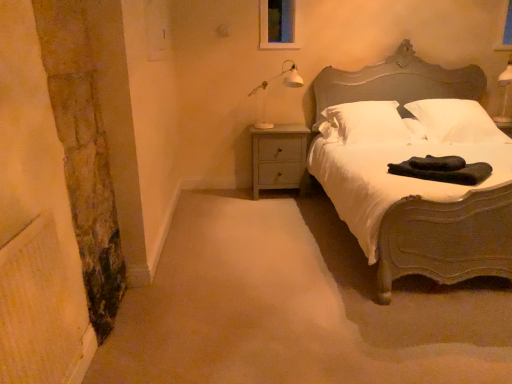
Image resolution: width=512 pixels, height=384 pixels. I want to click on dark green fabric at bed, so click(x=443, y=170).

Image resolution: width=512 pixels, height=384 pixels. In order to click on white glossy lamp at upper right in this screenshot , I will do `click(283, 84)`.

The image size is (512, 384). Find the location of `white soft pillow at center, the 2th pillow positioned from the right`. white soft pillow at center, the 2th pillow positioned from the right is located at coordinates (364, 123).

What are the coordinates of `white soft pillow at upper right, the second pillow positioned from the left` in the screenshot? It's located at (456, 121).

In the scene shown: How far apart are white painted wood nightstand at lower left and white soft pillow at center, the 1th pillow from the left?

white painted wood nightstand at lower left is 19.75 inches away from white soft pillow at center, the 1th pillow from the left.

Which of these two, white painted wood nightstand at lower left or white soft pillow at center, the 2th pillow positioned from the right, is bigger?

white soft pillow at center, the 2th pillow positioned from the right.

Considering the positions of objects white painted wood nightstand at lower left and white soft pillow at center, the 1th pillow from the left, in the image provided, who is more to the right, white painted wood nightstand at lower left or white soft pillow at center, the 1th pillow from the left,?

white soft pillow at center, the 1th pillow from the left, is more to the right.

Could you tell me if white painted wood nightstand at lower left is turned towards white soft pillow at center, the 1th pillow from the left?

No.

From the image's perspective, between white glossy lamp at upper right and white soft pillow at center, the 2th pillow positioned from the right, which one is located above?

white glossy lamp at upper right appears higher in the image.

How different are the orientations of white glossy lamp at upper right and white soft pillow at center, the 2th pillow positioned from the right, in degrees?

The angle between the facing direction of white glossy lamp at upper right and the facing direction of white soft pillow at center, the 2th pillow positioned from the right, is 0.847 degrees.

Is white glossy lamp at upper right wider or thinner than white soft pillow at center, the 2th pillow positioned from the right?

white glossy lamp at upper right is thinner than white soft pillow at center, the 2th pillow positioned from the right.

Considering the points (279, 74) and (352, 143), which point is in front, point (279, 74) or point (352, 143)?

The point (352, 143) is closer to the camera.

Is white soft pillow at center, the 2th pillow positioned from the right, spatially inside white glossy lamp at upper right, or outside of it?

white soft pillow at center, the 2th pillow positioned from the right, cannot be found inside white glossy lamp at upper right.

Is point (365, 116) positioned in front of point (286, 75)?

Yes.

I want to click on lamp on the left of the white soft pillow at center, the 1th pillow from the left, so click(x=283, y=84).

Can you confirm if white soft pillow at center, the 1th pillow from the left, is smaller than white glossy lamp at upper right?

Actually, white soft pillow at center, the 1th pillow from the left, might be larger than white glossy lamp at upper right.

From a real-world perspective, who is located lower, dark green fabric at bed or white soft pillow at center, the 2th pillow positioned from the right?

dark green fabric at bed.

From the image's perspective, is dark green fabric at bed over white soft pillow at center, the 2th pillow positioned from the right?

No, from the image's perspective, dark green fabric at bed is not above white soft pillow at center, the 2th pillow positioned from the right.

Is dark green fabric at bed looking in the opposite direction of white soft pillow at center, the 1th pillow from the left?

No, dark green fabric at bed is not facing the opposite direction of white soft pillow at center, the 1th pillow from the left.

In terms of size, does dark green fabric at bed appear bigger or smaller than white soft pillow at center, the 1th pillow from the left?

dark green fabric at bed is smaller than white soft pillow at center, the 1th pillow from the left.

From the picture: From a real-world perspective, which is physically below, matte gray bed at right or white painted wood nightstand at lower left?

From a 3D spatial view, white painted wood nightstand at lower left is below.

Is matte gray bed at right bigger than white painted wood nightstand at lower left?

Yes, matte gray bed at right is bigger than white painted wood nightstand at lower left.

Considering the relative sizes of matte gray bed at right and white painted wood nightstand at lower left in the image provided, is matte gray bed at right thinner than white painted wood nightstand at lower left?

In fact, matte gray bed at right might be wider than white painted wood nightstand at lower left.

Looking at this image, from a real-world perspective, is white soft pillow at center, the 2th pillow positioned from the right, physically below transparent glass window at upper center?

Yes, from a real-world perspective, white soft pillow at center, the 2th pillow positioned from the right, is below transparent glass window at upper center.

Is there a large distance between white soft pillow at center, the 1th pillow from the left, and transparent glass window at upper center?

No.

From the image's perspective, does white soft pillow at center, the 2th pillow positioned from the right, appear lower than transparent glass window at upper center?

Yes, from the image's perspective, white soft pillow at center, the 2th pillow positioned from the right, is below transparent glass window at upper center.

Is matte gray bed at right spatially inside white soft pillow at upper right, the second pillow positioned from the left, or outside of it?

matte gray bed at right lies outside white soft pillow at upper right, the second pillow positioned from the left.

Is matte gray bed at right looking in the opposite direction of white soft pillow at upper right, the second pillow positioned from the left?

Yes, matte gray bed at right is positioned with its back facing white soft pillow at upper right, the second pillow positioned from the left.

The width and height of the screenshot is (512, 384). Find the location of `pillow on the right of matte gray bed at right`. pillow on the right of matte gray bed at right is located at coordinates (456, 121).

Considering the relative positions of matte gray bed at right and white soft pillow at upper right, the second pillow positioned from the left, in the image provided, is matte gray bed at right to the left of white soft pillow at upper right, the second pillow positioned from the left, from the viewer's perspective?

Yes, matte gray bed at right is to the left of white soft pillow at upper right, the second pillow positioned from the left.

Locate an element on the screen. Image resolution: width=512 pixels, height=384 pixels. nightstand that is under the white soft pillow at center, the 1th pillow from the left (from a real-world perspective) is located at coordinates (280, 158).

The width and height of the screenshot is (512, 384). In order to click on the 1st pillow to the right of the white glossy lamp at upper right, counting from the anchor's position in this screenshot , I will do `click(364, 123)`.

Estimate the real-world distances between objects in this image. Which object is closer to white soft pillow at upper right, which ranks as the 1th pillow in right-to-left order, matte gray bed at right or white glossy lamp at upper right?

Among the two, matte gray bed at right is located nearer to white soft pillow at upper right, which ranks as the 1th pillow in right-to-left order.

Based on their spatial positions, is white soft pillow at center, the 2th pillow positioned from the right, or dark green fabric at bed closer to white painted wood nightstand at lower left?

white soft pillow at center, the 2th pillow positioned from the right, is positioned closer to the anchor white painted wood nightstand at lower left.

Estimate the real-world distances between objects in this image. Which object is closer to transparent glass window at upper center, white painted wood nightstand at lower left or white soft pillow at upper right, the second pillow positioned from the left?

Among the two, white painted wood nightstand at lower left is located nearer to transparent glass window at upper center.

Considering their positions, is white painted wood nightstand at lower left positioned closer to white soft pillow at center, the 2th pillow positioned from the right, than matte gray bed at right?

Based on the image, matte gray bed at right appears to be nearer to white soft pillow at center, the 2th pillow positioned from the right.

Looking at the image, which one is located closer to white painted wood nightstand at lower left, matte gray bed at right or white glossy lamp at upper right?

Among the two, white glossy lamp at upper right is located nearer to white painted wood nightstand at lower left.

Which object lies nearer to the anchor point white soft pillow at upper right, which ranks as the 1th pillow in right-to-left order, transparent glass window at upper center or white glossy lamp at upper right?

white glossy lamp at upper right.

From the image, which object appears to be nearer to matte gray bed at right, white glossy lamp at upper right or transparent glass window at upper center?

white glossy lamp at upper right is positioned closer to the anchor matte gray bed at right.

From the image, which object appears to be nearer to dark green fabric at bed, transparent glass window at upper center or white painted wood nightstand at lower left?

white painted wood nightstand at lower left is positioned closer to the anchor dark green fabric at bed.

The image size is (512, 384). Identify the location of lamp situated between white painted wood nightstand at lower left and white soft pillow at upper right, the second pillow positioned from the left, from left to right. (283, 84).

Locate an element on the screen. The image size is (512, 384). lamp between matte gray bed at right and transparent glass window at upper center along the z-axis is located at coordinates (283, 84).

Find the location of a particular element. pillow situated between white glossy lamp at upper right and white soft pillow at upper right, the second pillow positioned from the left, from left to right is located at coordinates (364, 123).

You are a GUI agent. You are given a task and a screenshot of the screen. Output one action in this format:
    pyautogui.click(x=<x>, y=<y>)
    Task: Click on the window screen between white painted wood nightstand at lower left and white soft pillow at upper right, the second pillow positioned from the left
    The image size is (512, 384).
    Given the screenshot: What is the action you would take?
    pyautogui.click(x=279, y=24)